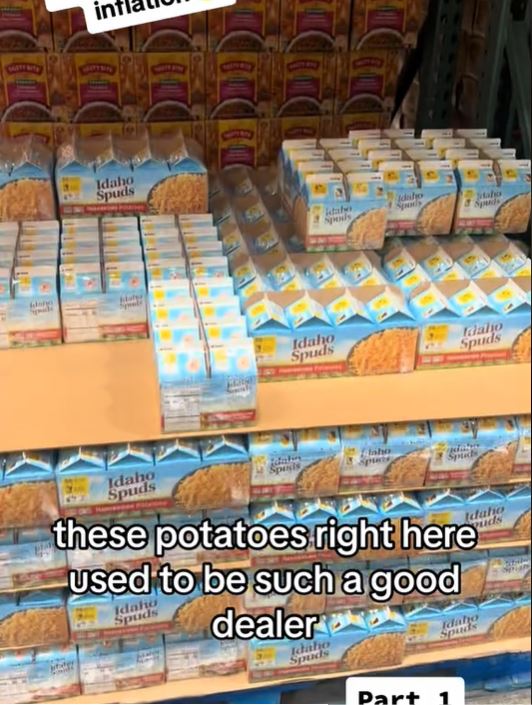
Find the location of a particular element. Image resolution: width=532 pixels, height=705 pixels. bare shelf is located at coordinates (73, 373).